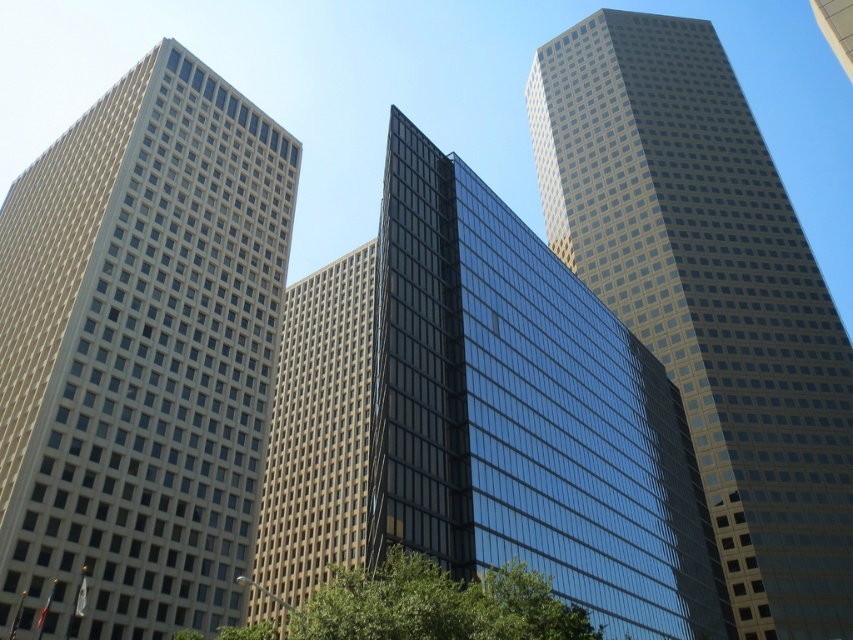
You are an architect analyzing the layout of the skyscrapers. Based on the scene, which of the two buildings, the beige glass building at left or the glassy reflective skyscraper at center, is positioned higher in the image?

The beige glass building at left is positioned higher in the image than the glassy reflective skyscraper at center, as it is located above it.

You are an architect analyzing the skyline of this city. You notice the beige glass building at left and the green leafy tree at lower center. Which structure occupies a larger area in the image?

The beige glass building at left is bigger than the green leafy tree at lower center, so it occupies a larger area in the image.